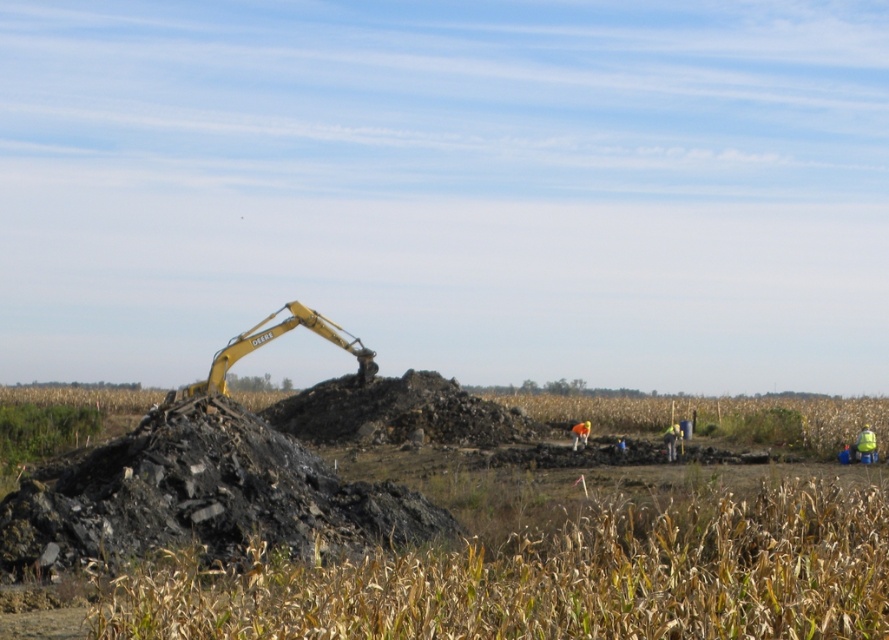
Who is higher up, yellow hard hat at center or orange fabric at center?

yellow hard hat at center is higher up.

Does point (673, 426) lie in front of point (575, 438)?

No, (673, 426) is further to viewer.

Is point (675, 432) farther from camera compared to point (573, 449)?

Yes, point (675, 432) is farther from viewer.

Identify the location of yellow hard hat at center. (671, 442).

Can you confirm if green reflective safety vest at lower right is shorter than orange fabric at center?

No.

Is green reflective safety vest at lower right wider than orange fabric at center?

No.

Image resolution: width=889 pixels, height=640 pixels. In order to click on green reflective safety vest at lower right in this screenshot , I will do `click(865, 445)`.

What do you see at coordinates (557, 579) in the screenshot? I see `brown grass at lower center` at bounding box center [557, 579].

Locate an element on the screen. brown grass at lower center is located at coordinates (557, 579).